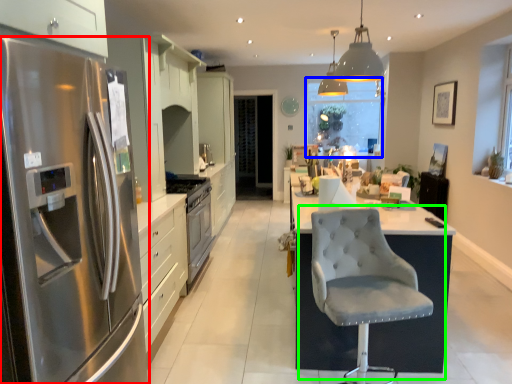
Question: Estimate the real-world distances between objects in this image. Which object is farther from refrigerator (highlighted by a red box), window screen (highlighted by a blue box) or chair (highlighted by a green box)?

Choices:
 (A) window screen
 (B) chair

Answer: (A)